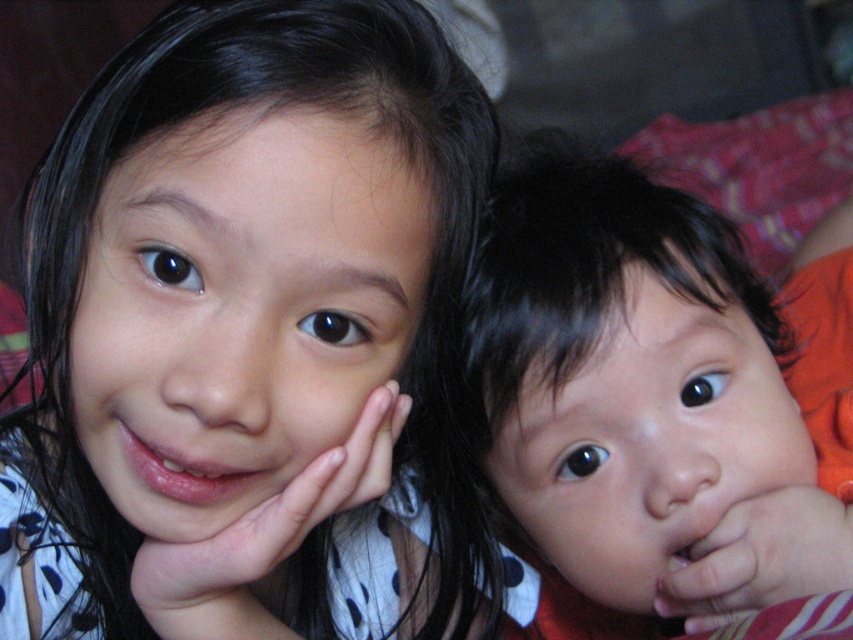
Which of these two, smooth skin face at center or pink matte hand at lower left, stands taller?

With more height is smooth skin face at center.

Looking at this image, can you confirm if smooth skin face at center is thinner than pink matte hand at lower left?

No, smooth skin face at center is not thinner than pink matte hand at lower left.

Who is more forward, (265, 154) or (260, 621)?

Point (265, 154) is in front.

The height and width of the screenshot is (640, 853). Find the location of `smooth skin face at center`. smooth skin face at center is located at coordinates 241,308.

Which is more to the left, smooth skin baby at center or pink matte hand at lower left?

Positioned to the left is pink matte hand at lower left.

Who is more forward, (549, 492) or (158, 545)?

Point (158, 545)

Locate an element on the screen. The width and height of the screenshot is (853, 640). smooth skin baby at center is located at coordinates (647, 442).

Does pink matte hand at lower left appear on the left side of smooth skin hand at lower right?

Yes, pink matte hand at lower left is to the left of smooth skin hand at lower right.

Does pink matte hand at lower left have a larger size compared to smooth skin hand at lower right?

Indeed, pink matte hand at lower left has a larger size compared to smooth skin hand at lower right.

Who is more forward, (370, 426) or (776, 586)?

Point (370, 426) is more forward.

Locate an element on the screen. pink matte hand at lower left is located at coordinates (270, 525).